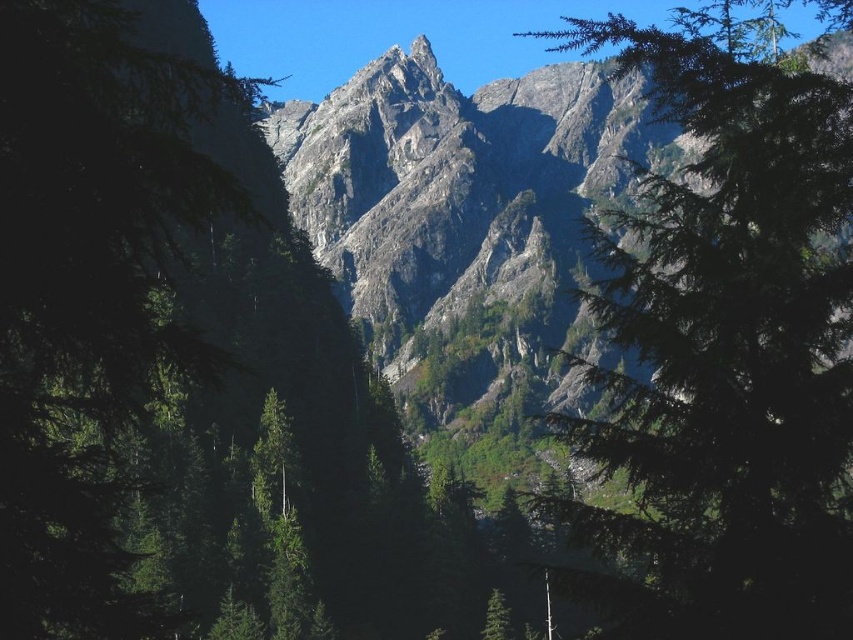
Based on the photo, you are planning to take a photo of the rugged stone mountain range at center and the green matte tree at right. Which object should you focus on first if you want to capture both in a single frame without moving the camera?

The green matte tree at right is larger in size than the rugged stone mountain range at center, so focusing on the tree first would ensure it fits well in the frame before adjusting for the mountain range.

You are an outdoor enthusiast planning a hiking route. You need to decide whether to hike towards the green matte tree at right or the rugged stone mountain range at center. Based on their positions, which one is closer to your current position?

The green matte tree at right is located below the rugged stone mountain range at center, meaning it is closer to your current position. Therefore, you should choose the green matte tree at right as your closer hiking option.

You are standing in the mountain landscape and want to take a photo of the green matte tree at right. Where should you position yourself to capture the tree in the frame?

To capture the green matte tree at right in the frame, position yourself at point (723, 346).